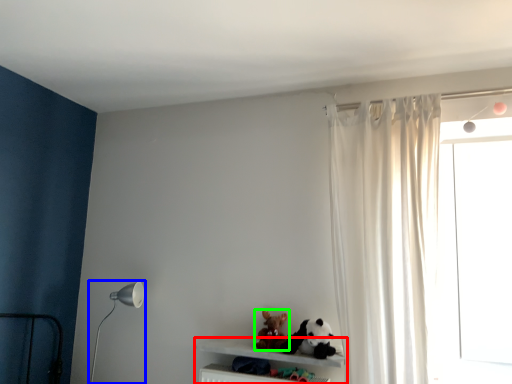
Question: Considering the real-world distances, which object is farthest from shelf (highlighted by a red box)? table lamp (highlighted by a blue box) or toy (highlighted by a green box)?

Choices:
 (A) table lamp
 (B) toy

Answer: (A)